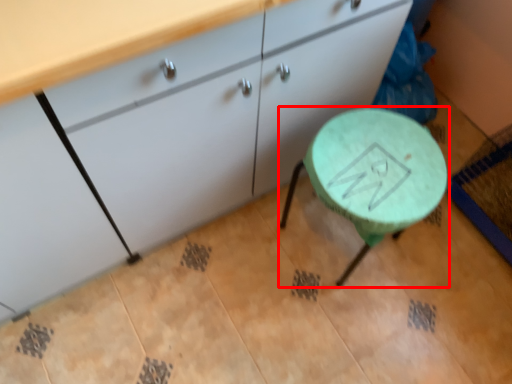
Question: From the image, what is the correct spatial relationship of table (annotated by the red box) in relation to cabinetry?

Choices:
 (A) right
 (B) left

Answer: (A)